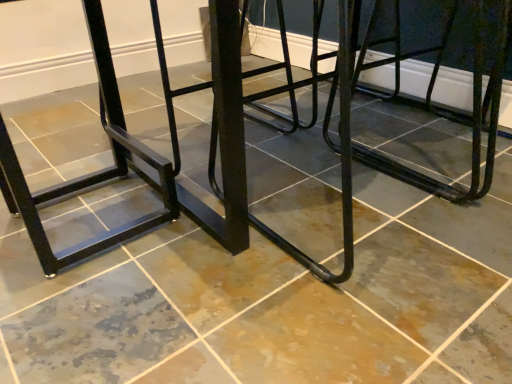
The height and width of the screenshot is (384, 512). What do you see at coordinates (91, 173) in the screenshot?
I see `black matte metal bar stool at left` at bounding box center [91, 173].

Locate an element on the screen. This screenshot has width=512, height=384. black matte metal bar stool at left is located at coordinates (91, 173).

Describe the element at coordinates (170, 163) in the screenshot. I see `black metal table at center` at that location.

Measure the distance between point (218, 93) and camera.

Point (218, 93) and camera are 32.17 inches apart from each other.

At what (x,y) coordinates should I click in order to perform the action: click on black metal table at center. Please return your answer as a coordinate pair (x, y). Looking at the image, I should click on (170, 163).

Measure the distance between black metal table at center and camera.

They are 27.11 inches apart.

You are a GUI agent. You are given a task and a screenshot of the screen. Output one action in this format:
    pyautogui.click(x=<x>, y=<y>)
    Task: Click on the black matte metal bar stool at left
    The height and width of the screenshot is (384, 512).
    Given the screenshot: What is the action you would take?
    pyautogui.click(x=91, y=173)

Can you confirm if black matte metal bar stool at left is positioned to the right of black metal table at center?

No.

In the image, is black matte metal bar stool at left positioned in front of or behind black metal table at center?

black matte metal bar stool at left is behind black metal table at center.

Considering the positions of points (96, 59) and (224, 53), is point (96, 59) farther from camera compared to point (224, 53)?

Yes, point (96, 59) is farther from viewer.

From the image's perspective, between black matte metal bar stool at left and black metal table at center, which one is located above?

black metal table at center appears higher in the image.

From a real-world perspective, relative to black metal table at center, is black matte metal bar stool at left vertically above or below?

From a real-world perspective, black matte metal bar stool at left is physically below black metal table at center.

Between black matte metal bar stool at left and black metal table at center, which one has smaller width?

black matte metal bar stool at left.

Does black matte metal bar stool at left have a greater height compared to black metal table at center?

Correct, black matte metal bar stool at left is much taller as black metal table at center.

Based on their sizes in the image, would you say black matte metal bar stool at left is bigger or smaller than black metal table at center?

In the image, black matte metal bar stool at left appears to be smaller than black metal table at center.

Looking at this image, is black matte metal bar stool at left not inside black metal table at center?

No, black matte metal bar stool at left is inside black metal table at center's boundary.

Is black matte metal bar stool at left not close to black metal table at center?

No, black matte metal bar stool at left is not far away from black metal table at center.

Is black matte metal bar stool at left oriented away from black metal table at center?

No, black matte metal bar stool at left's orientation is not away from black metal table at center.

How much distance is there between black matte metal bar stool at left and black metal table at center?

3.39 inches.

You are a GUI agent. You are given a task and a screenshot of the screen. Output one action in this format:
    pyautogui.click(x=<x>, y=<y>)
    Task: Click on the bar stool lying below the black metal table at center (from the image's perspective)
    The width and height of the screenshot is (512, 384).
    Given the screenshot: What is the action you would take?
    pyautogui.click(x=91, y=173)

Is black metal table at center at the left side of black matte metal bar stool at left?

Incorrect, black metal table at center is not on the left side of black matte metal bar stool at left.

Is black metal table at center positioned in front of black matte metal bar stool at left?

Yes.

Which is less distant, [188,215] or [35,242]?

Point [188,215] is positioned farther from the camera compared to point [35,242].

From the image's perspective, between black metal table at center and black matte metal bar stool at left, who is located below?

black matte metal bar stool at left appears lower in the image.

From a real-world perspective, is black metal table at center physically above black matte metal bar stool at left?

Correct, in the physical world, black metal table at center is higher than black matte metal bar stool at left.

Which of these two, black metal table at center or black matte metal bar stool at left, is thinner?

black matte metal bar stool at left.

Which of these two, black metal table at center or black matte metal bar stool at left, stands shorter?

black metal table at center.

Considering the sizes of objects black metal table at center and black matte metal bar stool at left in the image provided, who is bigger, black metal table at center or black matte metal bar stool at left?

black metal table at center is bigger.

Can we say black metal table at center lies outside black matte metal bar stool at left?

Yes, black metal table at center is outside of black matte metal bar stool at left.

Can you see black metal table at center touching black matte metal bar stool at left?

Yes, black metal table at center is right next to black matte metal bar stool at left and making contact.

Is black metal table at center facing away from black matte metal bar stool at left?

black metal table at center does not have its back to black matte metal bar stool at left.

How many degrees apart are the facing directions of black metal table at center and black matte metal bar stool at left?

The angle between the facing direction of black metal table at center and the facing direction of black matte metal bar stool at left is 180 degrees.

At what (x,y) coordinates should I click in order to perform the action: click on bar stool behind the black metal table at center. Please return your answer as a coordinate pair (x, y). Image resolution: width=512 pixels, height=384 pixels. Looking at the image, I should click on (91, 173).

The image size is (512, 384). In order to click on bar stool behind the black metal table at center in this screenshot , I will do `click(91, 173)`.

This screenshot has height=384, width=512. What are the coordinates of `furniture in front of the black matte metal bar stool at left` in the screenshot? It's located at (170, 163).